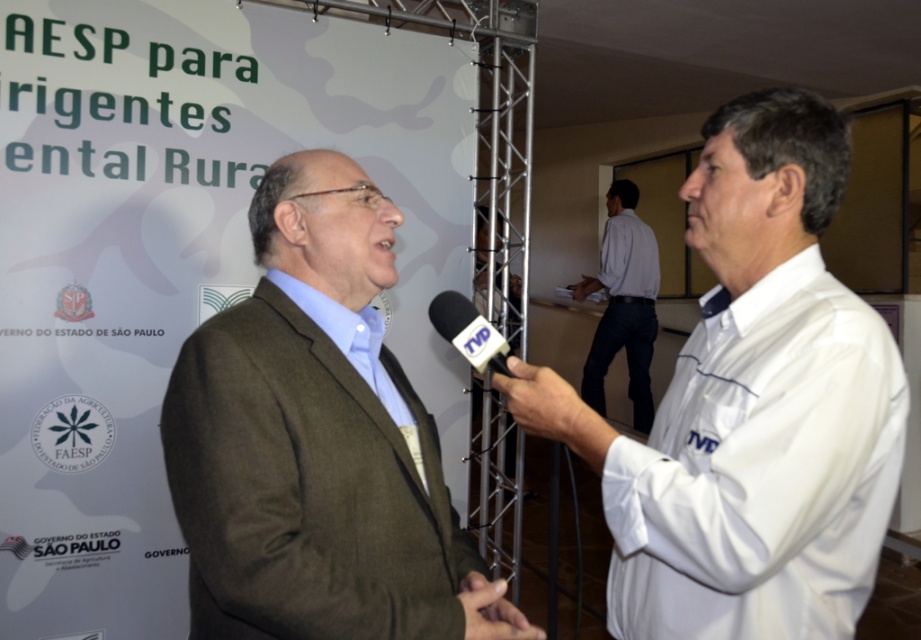
Is white shirt at center below black plastic microphone at center?

Actually, white shirt at center is above black plastic microphone at center.

Describe the element at coordinates (624, 305) in the screenshot. I see `white shirt at center` at that location.

Find the location of a particular element. The width and height of the screenshot is (921, 640). white shirt at center is located at coordinates (624, 305).

You are a GUI agent. You are given a task and a screenshot of the screen. Output one action in this format:
    pyautogui.click(x=<x>, y=<y>)
    Task: Click on the white shirt at center
    The width and height of the screenshot is (921, 640).
    Given the screenshot: What is the action you would take?
    pyautogui.click(x=624, y=305)

Does white glossy shirt at center appear on the right side of black plastic microphone at center?

Correct, you'll find white glossy shirt at center to the right of black plastic microphone at center.

Can you confirm if white glossy shirt at center is positioned above black plastic microphone at center?

No.

Identify the location of white glossy shirt at center. (750, 406).

Consider the image. Measure the distance between white glossy shirt at center and camera.

The distance of white glossy shirt at center from camera is 33.09 inches.

Describe the element at coordinates (750, 406) in the screenshot. I see `white glossy shirt at center` at that location.

Locate an element on the screen. The width and height of the screenshot is (921, 640). white glossy shirt at center is located at coordinates (750, 406).